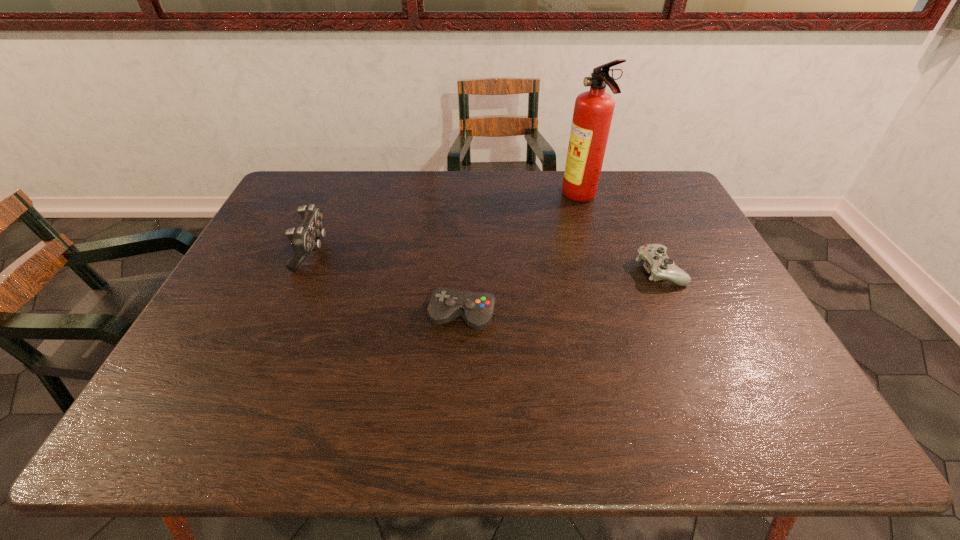
Locate an element on the screen. This screenshot has height=540, width=960. vacant space at the near right corner of the desktop is located at coordinates (820, 438).

This screenshot has height=540, width=960. Find the location of `unoccupied area between the rightmost control and the third shortest object`. unoccupied area between the rightmost control and the third shortest object is located at coordinates pyautogui.click(x=486, y=260).

Identify the location of free spot between the leftmost control and the second control from right to left. The height and width of the screenshot is (540, 960). (387, 284).

I want to click on empty location between the rightmost control and the second object from left to right, so click(x=561, y=293).

Locate an element on the screen. vacant space that's between the tallest control and the rightmost control is located at coordinates (486, 260).

The image size is (960, 540). Find the location of `vacant space that's between the farthest object and the rightmost object`. vacant space that's between the farthest object and the rightmost object is located at coordinates (620, 234).

Identify the location of free space that is in between the third shortest object and the farthest object. The image size is (960, 540). (446, 225).

This screenshot has height=540, width=960. I want to click on unoccupied area between the second tallest object and the third object from right to left, so click(x=387, y=284).

This screenshot has height=540, width=960. Find the location of `free area in between the tallest object and the second object from left to right`. free area in between the tallest object and the second object from left to right is located at coordinates (521, 257).

Where is `blank region between the second tallest object and the nearest control`? blank region between the second tallest object and the nearest control is located at coordinates (387, 284).